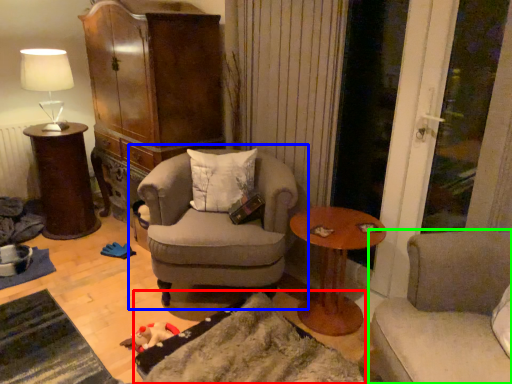
Question: Based on their relative distances, which object is nearer to wide (highlighted by a red box)? Choose from chair (highlighted by a blue box) and studio couch (highlighted by a green box).

Choices:
 (A) chair
 (B) studio couch

Answer: (A)